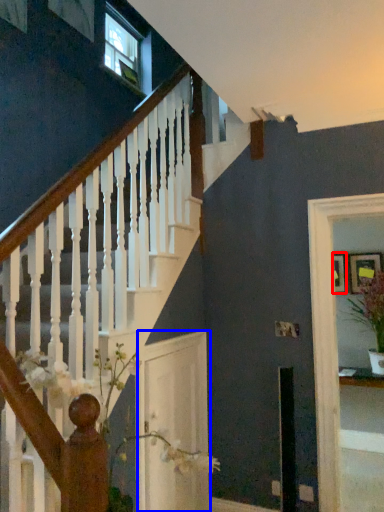
Question: Which object is further to the camera taking this photo, picture frame (highlighted by a red box) or glass door (highlighted by a blue box)?

Choices:
 (A) picture frame
 (B) glass door

Answer: (A)